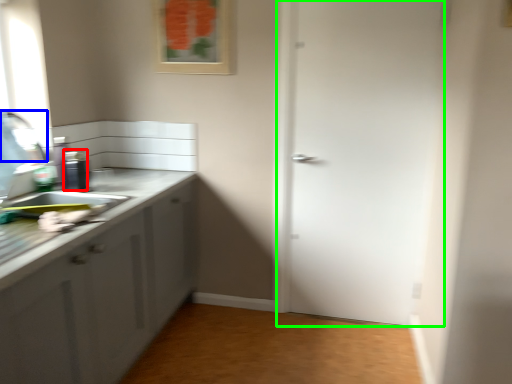
Question: Based on their relative distances, which object is nearer to appliance (highlighted by a red box)? Choose from faucet (highlighted by a blue box) and door (highlighted by a green box).

Choices:
 (A) faucet
 (B) door

Answer: (A)